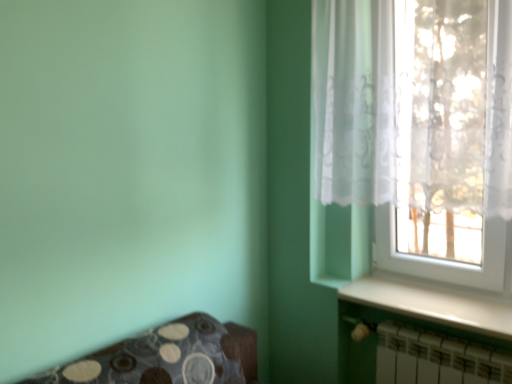
Question: Is white glossy window sill at lower right aimed at translucent fabric at upper right?

Choices:
 (A) yes
 (B) no

Answer: (B)

Question: From the image's perspective, would you say white glossy window sill at lower right is positioned over translucent fabric at upper right?

Choices:
 (A) no
 (B) yes

Answer: (A)

Question: Is white glossy window sill at lower right at the right side of translucent fabric at upper right?

Choices:
 (A) no
 (B) yes

Answer: (B)

Question: Does white glossy window sill at lower right have a greater height compared to translucent fabric at upper right?

Choices:
 (A) no
 (B) yes

Answer: (A)

Question: From a real-world perspective, is white glossy window sill at lower right on translucent fabric at upper right?

Choices:
 (A) no
 (B) yes

Answer: (A)

Question: From a real-world perspective, is white glossy window sill at lower right positioned under translucent fabric at upper right based on gravity?

Choices:
 (A) yes
 (B) no

Answer: (A)

Question: Is white glossy window sill at lower right shorter than white metallic radiator at lower right?

Choices:
 (A) no
 (B) yes

Answer: (B)

Question: Is white metallic radiator at lower right at the back of white glossy window sill at lower right?

Choices:
 (A) no
 (B) yes

Answer: (A)

Question: Does white glossy window sill at lower right appear on the left side of white metallic radiator at lower right?

Choices:
 (A) yes
 (B) no

Answer: (B)

Question: Is white glossy window sill at lower right in contact with white metallic radiator at lower right?

Choices:
 (A) no
 (B) yes

Answer: (A)

Question: Considering the relative sizes of white glossy window sill at lower right and white metallic radiator at lower right in the image provided, is white glossy window sill at lower right thinner than white metallic radiator at lower right?

Choices:
 (A) yes
 (B) no

Answer: (B)

Question: Is white glossy window sill at lower right further to camera compared to white metallic radiator at lower right?

Choices:
 (A) no
 (B) yes

Answer: (B)

Question: Does translucent fabric at upper right touch white metallic radiator at lower right?

Choices:
 (A) yes
 (B) no

Answer: (B)